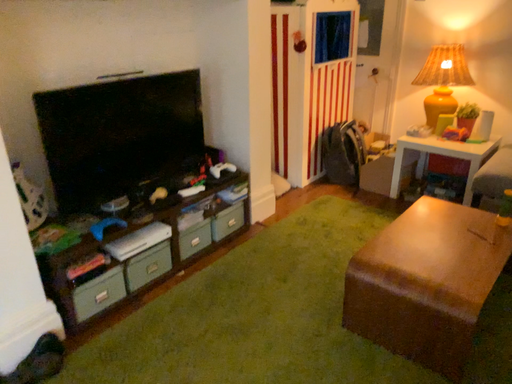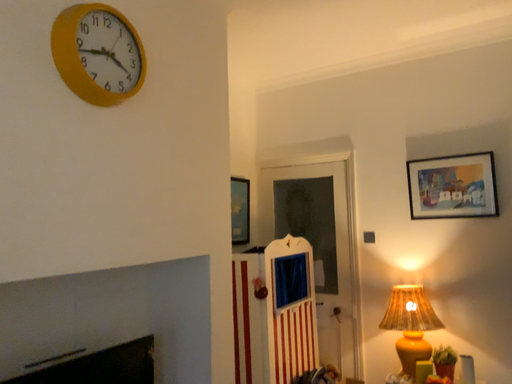
Question: How did the camera likely rotate when shooting the video?

Choices:
 (A) rotated downward
 (B) rotated upward

Answer: (B)